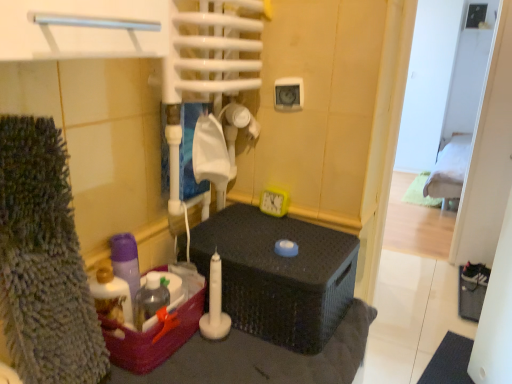
Locate an element on the screen. The image size is (512, 384). vacant area located to the right-hand side of translucent plastic bottle at lower left is located at coordinates (227, 359).